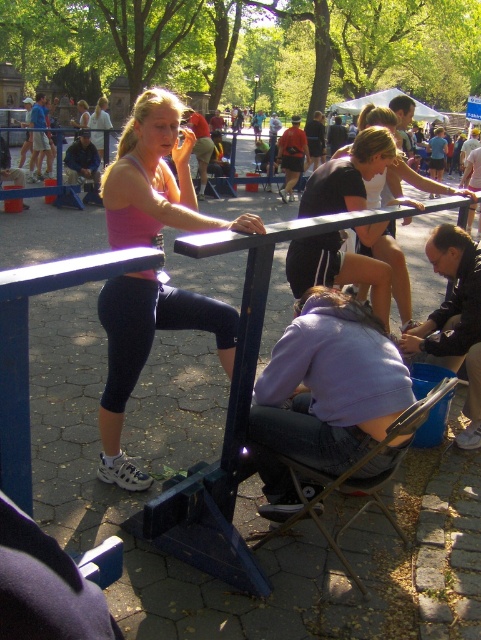
Who is positioned more to the right, metallic silver chair at lower center or matte black shirt at center?

matte black shirt at center is more to the right.

Does metallic silver chair at lower center appear on the left side of matte black shirt at center?

Correct, you'll find metallic silver chair at lower center to the left of matte black shirt at center.

Is point (308, 500) behind point (403, 163)?

No, it is not.

The width and height of the screenshot is (481, 640). Find the location of `metallic silver chair at lower center`. metallic silver chair at lower center is located at coordinates (359, 480).

Is purple fleece jacket at lower center closer to camera compared to metallic silver chair at lower center?

No, it is behind metallic silver chair at lower center.

Who is more forward, (x=317, y=356) or (x=392, y=429)?

Positioned in front is point (x=392, y=429).

Between point (282, 426) and point (266, 541), which one is positioned behind?

The point (266, 541) is more distant.

Identify the location of purple fleece jacket at lower center. This screenshot has height=640, width=481. (329, 385).

Is purple fleece jacket at lower center in front of dark brown leather jacket at lower right?

Yes, purple fleece jacket at lower center is in front of dark brown leather jacket at lower right.

Does purple fleece jacket at lower center appear on the right side of dark brown leather jacket at lower right?

Incorrect, purple fleece jacket at lower center is not on the right side of dark brown leather jacket at lower right.

In order to click on purple fleece jacket at lower center in this screenshot , I will do `click(329, 385)`.